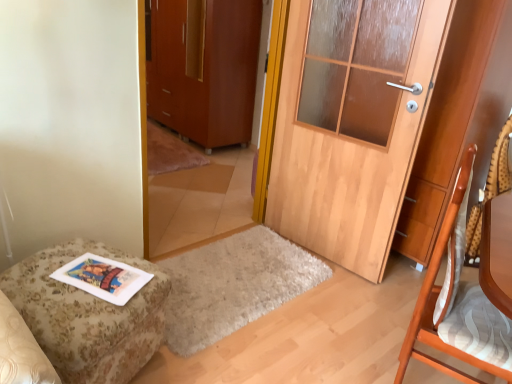
Question: Is matte brown cabinet at center a part of floral fabric ottoman at lower left?

Choices:
 (A) no
 (B) yes

Answer: (A)

Question: Does floral fabric ottoman at lower left turn towards matte brown cabinet at center?

Choices:
 (A) no
 (B) yes

Answer: (A)

Question: Does floral fabric ottoman at lower left appear on the left side of matte brown cabinet at center?

Choices:
 (A) yes
 (B) no

Answer: (B)

Question: From a real-world perspective, is floral fabric ottoman at lower left located higher than matte brown cabinet at center?

Choices:
 (A) yes
 (B) no

Answer: (B)

Question: Considering the relative sizes of floral fabric ottoman at lower left and matte brown cabinet at center in the image provided, is floral fabric ottoman at lower left taller than matte brown cabinet at center?

Choices:
 (A) no
 (B) yes

Answer: (A)

Question: In the image, is floral fabric ottoman at lower left on the left side or the right side of wooden chair at right?

Choices:
 (A) right
 (B) left

Answer: (B)

Question: Looking at the image, does floral fabric ottoman at lower left seem bigger or smaller compared to wooden chair at right?

Choices:
 (A) big
 (B) small

Answer: (B)

Question: Considering their positions, is floral fabric ottoman at lower left located in front of or behind wooden chair at right?

Choices:
 (A) front
 (B) behind

Answer: (B)

Question: Would you say floral fabric ottoman at lower left is inside or outside wooden chair at right?

Choices:
 (A) outside
 (B) inside

Answer: (A)

Question: Does point (433, 334) appear closer or farther from the camera than point (493, 163)?

Choices:
 (A) closer
 (B) farther

Answer: (A)

Question: Is wooden chair at right taller or shorter than wooden textured swivel chair at right?

Choices:
 (A) tall
 (B) short

Answer: (A)

Question: In terms of width, does wooden chair at right look wider or thinner when compared to wooden textured swivel chair at right?

Choices:
 (A) thin
 (B) wide

Answer: (B)

Question: Do you think wooden chair at right is within wooden textured swivel chair at right, or outside of it?

Choices:
 (A) inside
 (B) outside

Answer: (B)

Question: Is point (493, 279) positioned closer to the camera than point (159, 117)?

Choices:
 (A) closer
 (B) farther

Answer: (A)

Question: From a real-world perspective, is wooden chair at right above or below matte brown cabinet at center?

Choices:
 (A) above
 (B) below

Answer: (B)